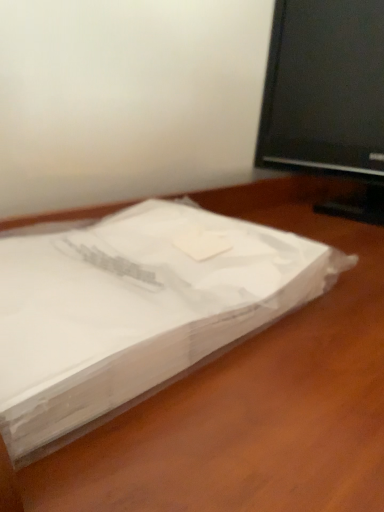
Question: From the image's perspective, is white paper at center below black glossy television at upper right?

Choices:
 (A) no
 (B) yes

Answer: (B)

Question: From a real-world perspective, is white paper at center under black glossy television at upper right?

Choices:
 (A) yes
 (B) no

Answer: (A)

Question: Considering the relative positions of white paper at center and black glossy television at upper right in the image provided, is white paper at center to the right of black glossy television at upper right from the viewer's perspective?

Choices:
 (A) no
 (B) yes

Answer: (A)

Question: Is white paper at center closer to camera compared to black glossy television at upper right?

Choices:
 (A) yes
 (B) no

Answer: (A)

Question: Is black glossy television at upper right surrounded by white paper at center?

Choices:
 (A) yes
 (B) no

Answer: (B)

Question: Is white paper at center oriented towards black glossy television at upper right?

Choices:
 (A) yes
 (B) no

Answer: (B)

Question: From a real-world perspective, is black glossy television at upper right located higher than white paper at center?

Choices:
 (A) no
 (B) yes

Answer: (B)

Question: From the image's perspective, is black glossy television at upper right above white paper at center?

Choices:
 (A) no
 (B) yes

Answer: (B)

Question: Is black glossy television at upper right behind white paper at center?

Choices:
 (A) no
 (B) yes

Answer: (B)

Question: Does black glossy television at upper right have a smaller size compared to white paper at center?

Choices:
 (A) no
 (B) yes

Answer: (B)

Question: Does black glossy television at upper right have a lesser width compared to white paper at center?

Choices:
 (A) no
 (B) yes

Answer: (B)

Question: Is black glossy television at upper right taller than white paper at center?

Choices:
 (A) yes
 (B) no

Answer: (B)

Question: Looking at their shapes, would you say white paper at center is wider or thinner than black glossy television at upper right?

Choices:
 (A) thin
 (B) wide

Answer: (B)